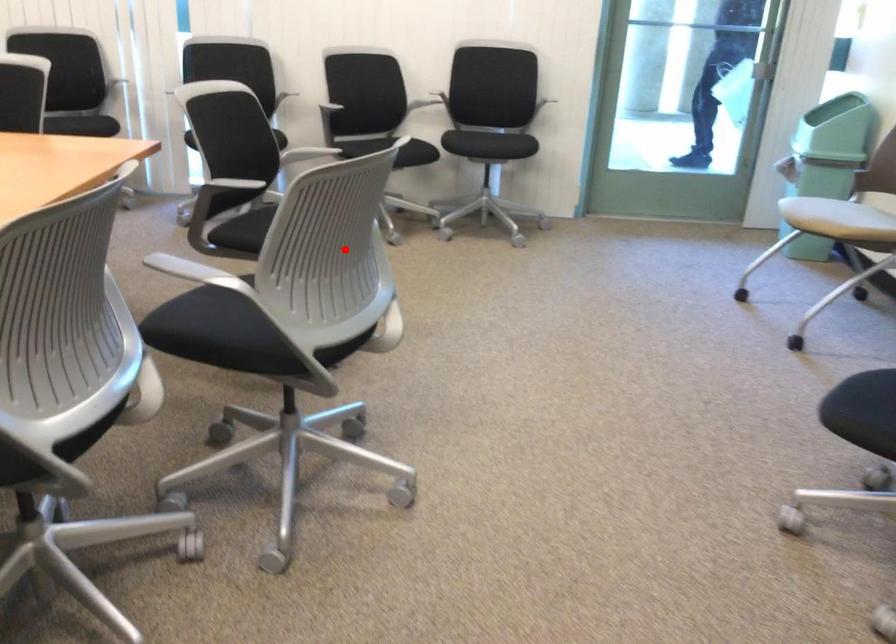
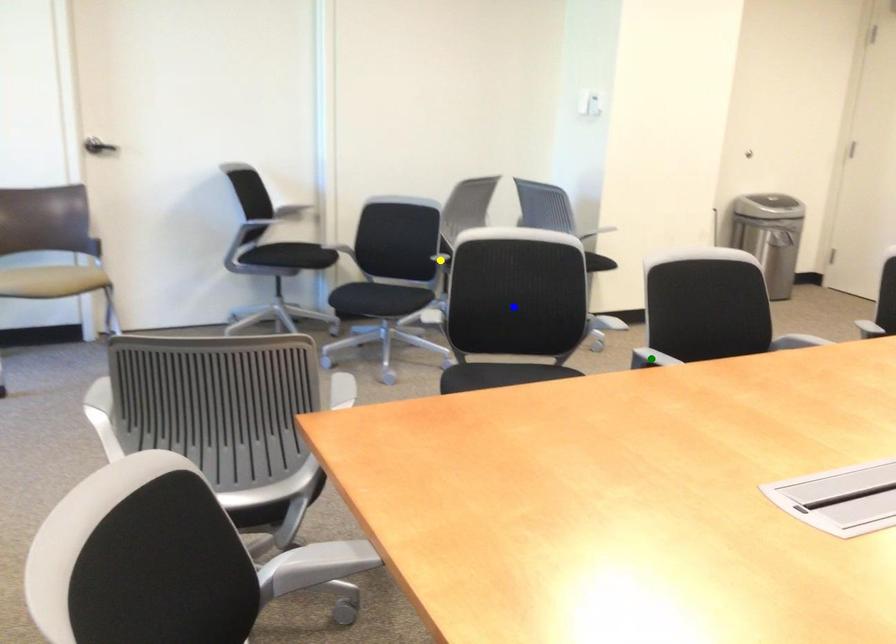
Question: I am providing you with two images of the same scene from different viewpoints. A red point is marked on the first image. You are given multiple points on the second image. Can you choose the point in image 2 that corresponds to the point in image 1?

Choices:
 (A) yellow point
 (B) blue point
 (C) green point

Answer: (B)